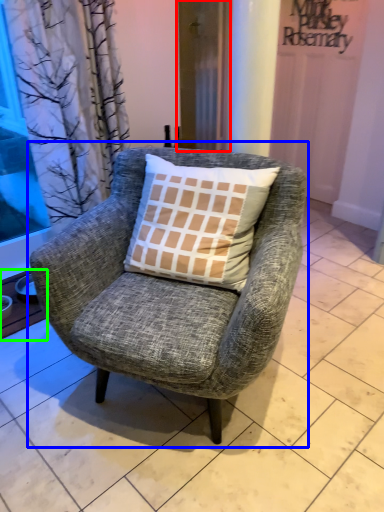
Question: Which object is the closest to the screen door (highlighted by a red box)? Choose among these: chair (highlighted by a blue box) or window sill (highlighted by a green box).

Choices:
 (A) chair
 (B) window sill

Answer: (A)